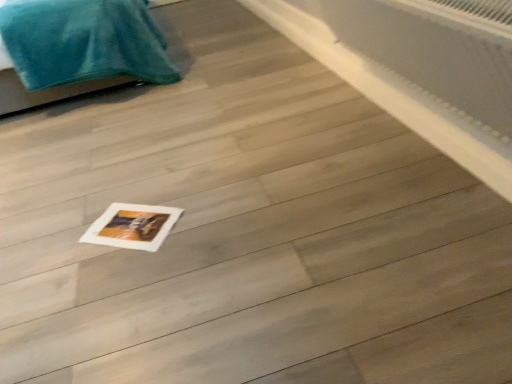
What do you see at coordinates (133, 226) in the screenshot? I see `white glossy magazine at center` at bounding box center [133, 226].

Locate an element on the screen. white glossy magazine at center is located at coordinates (133, 226).

Find the location of a particular element. The height and width of the screenshot is (384, 512). white glossy magazine at center is located at coordinates (133, 226).